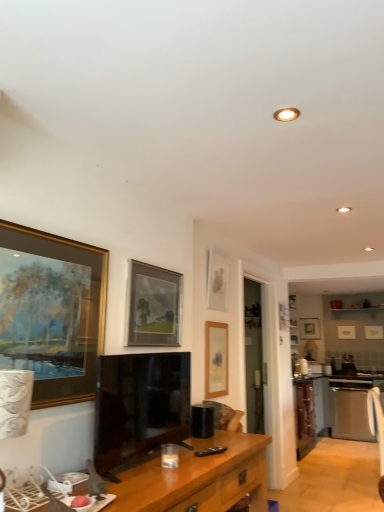
Find the location of a particular element. unoccupied area in front of black matte speaker at center, arranged as the 2th appliance when viewed from the back is located at coordinates (221, 441).